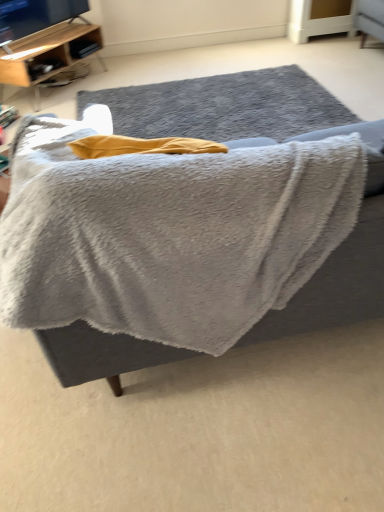
The height and width of the screenshot is (512, 384). Describe the element at coordinates (49, 55) in the screenshot. I see `wooden shelf at upper left` at that location.

You are a GUI agent. You are given a task and a screenshot of the screen. Output one action in this format:
    pyautogui.click(x=<x>, y=<y>)
    Task: Click on the gray woolen rug at center
    The image size is (384, 512).
    Given the screenshot: What is the action you would take?
    pyautogui.click(x=223, y=106)

Identify the location of wooden shelf at upper left. (49, 55).

Considering the relative sizes of gray fluffy blanket at center and gray woolen rug at center in the image provided, is gray fluffy blanket at center wider than gray woolen rug at center?

No.

Does point (364, 301) appear closer or farther from the camera than point (157, 86)?

Clearly, point (364, 301) is closer to the camera than point (157, 86).

Relative to gray woolen rug at center, is gray fluffy blanket at center in front or behind?

gray fluffy blanket at center is in front of gray woolen rug at center.

From the image's perspective, is gray fluffy blanket at center located above or below gray woolen rug at center?

Based on their image positions, gray fluffy blanket at center is located beneath gray woolen rug at center.

Is point (73, 76) closer or farther from the camera than point (271, 85)?

Point (73, 76) is positioned farther from the camera compared to point (271, 85).

Can you confirm if wooden shelf at upper left is bigger than gray fluffy blanket at center?

No, wooden shelf at upper left is not bigger than gray fluffy blanket at center.

Identify the location of shelf behind the gray fluffy blanket at center. (49, 55).

Measure the distance from wooden shelf at upper left to gray fluffy blanket at center.

wooden shelf at upper left is 78.87 centimeters from gray fluffy blanket at center.

Does gray woolen rug at center lie behind wooden shelf at upper left?

That is False.

Is gray woolen rug at center oriented towards wooden shelf at upper left?

No, gray woolen rug at center is not turned towards wooden shelf at upper left.

Considering the sizes of objects gray woolen rug at center and wooden shelf at upper left in the image provided, who is bigger, gray woolen rug at center or wooden shelf at upper left?

wooden shelf at upper left is bigger.

From the picture: Is gray woolen rug at center placed right next to wooden shelf at upper left?

No.

Is wooden shelf at upper left in front of or behind gray woolen rug at center in the image?

wooden shelf at upper left is positioned farther from the viewer than gray woolen rug at center.

Is wooden shelf at upper left placed right next to gray woolen rug at center?

No, wooden shelf at upper left is not touching gray woolen rug at center.

Does wooden shelf at upper left turn towards gray woolen rug at center?

Yes, wooden shelf at upper left faces towards gray woolen rug at center.

Based on the photo, which of these two, wooden shelf at upper left or gray woolen rug at center, is thinner?

wooden shelf at upper left is thinner.

Looking at this image, is gray woolen rug at center located outside gray fluffy blanket at center?

gray woolen rug at center is positioned outside gray fluffy blanket at center.

From a real-world perspective, is gray woolen rug at center beneath gray fluffy blanket at center?

Correct, in the physical world, gray woolen rug at center is lower than gray fluffy blanket at center.

Is gray woolen rug at center shorter than gray fluffy blanket at center?

Yes, gray woolen rug at center is shorter than gray fluffy blanket at center.

Between gray fluffy blanket at center and wooden shelf at upper left, which one is positioned behind?

wooden shelf at upper left is further from the camera.

Is gray fluffy blanket at center spatially inside wooden shelf at upper left, or outside of it?

gray fluffy blanket at center is spatially situated outside wooden shelf at upper left.

Considering the sizes of objects gray fluffy blanket at center and wooden shelf at upper left in the image provided, who is wider, gray fluffy blanket at center or wooden shelf at upper left?

gray fluffy blanket at center is wider.

Considering the points (141, 124) and (79, 41), which point is in front, point (141, 124) or point (79, 41)?

Point (141, 124)

The width and height of the screenshot is (384, 512). Identify the location of furniture below the gray woolen rug at center (from the image's perspective). (223, 106).

Where is `furniture in front of the wooden shelf at upper left`? furniture in front of the wooden shelf at upper left is located at coordinates (223, 106).

Looking at the image, which one is located further to gray woolen rug at center, gray fluffy blanket at center or wooden shelf at upper left?

wooden shelf at upper left is positioned further to the anchor gray woolen rug at center.

Based on their spatial positions, is wooden shelf at upper left or gray woolen rug at center closer to gray fluffy blanket at center?

gray woolen rug at center lies closer to gray fluffy blanket at center than the other object.

Estimate the real-world distances between objects in this image. Which object is closer to wooden shelf at upper left, gray woolen rug at center or gray fluffy blanket at center?

gray fluffy blanket at center is positioned closer to the anchor wooden shelf at upper left.

When comparing their distances from gray fluffy blanket at center, does gray woolen rug at center or wooden shelf at upper left seem further?

wooden shelf at upper left lies further to gray fluffy blanket at center than the other object.

Based on their spatial positions, is gray fluffy blanket at center or gray woolen rug at center further from wooden shelf at upper left?

gray woolen rug at center.

Considering their positions, is wooden shelf at upper left positioned further to gray woolen rug at center than gray fluffy blanket at center?

wooden shelf at upper left lies further to gray woolen rug at center than the other object.

Identify the location of mat between gray fluffy blanket at center and wooden shelf at upper left along the z-axis. Image resolution: width=384 pixels, height=512 pixels. (223, 106).